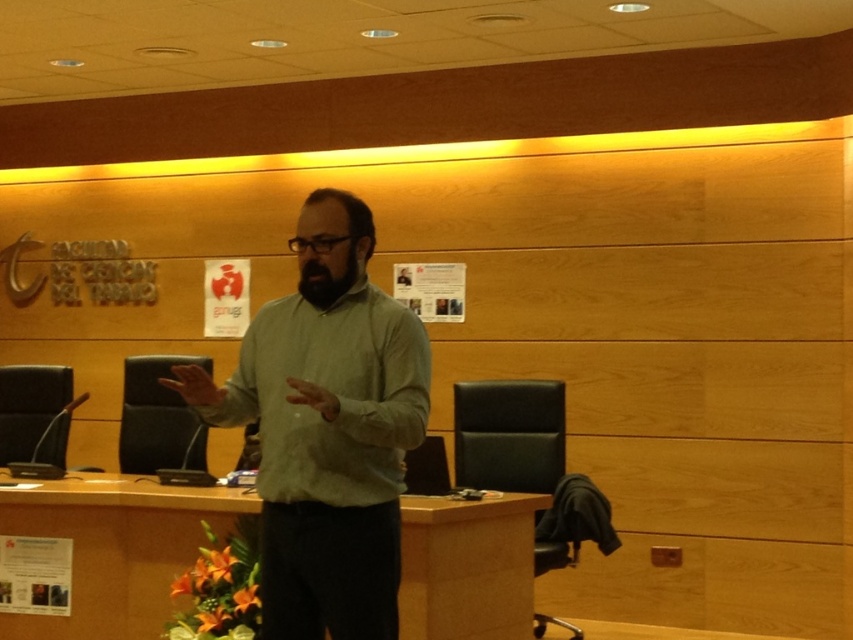
Question: Can you confirm if green matte shirt at center is bigger than black fuzzy beard at center?

Choices:
 (A) yes
 (B) no

Answer: (A)

Question: Estimate the real-world distances between objects in this image. Which object is closer to the black fuzzy beard at center?

Choices:
 (A) green matte dress shirt at center
 (B) green matte shirt at center

Answer: (A)

Question: Estimate the real-world distances between objects in this image. Which object is closer to the black fuzzy beard at center?

Choices:
 (A) green matte shirt at center
 (B) green matte dress shirt at center

Answer: (B)

Question: Which of the following is the closest to the observer?

Choices:
 (A) [325, 307]
 (B) [403, 440]
 (C) [347, 209]

Answer: (B)

Question: Can you confirm if green matte shirt at center is wider than black fuzzy beard at center?

Choices:
 (A) yes
 (B) no

Answer: (A)

Question: Can you confirm if green matte shirt at center is positioned to the right of green matte dress shirt at center?

Choices:
 (A) no
 (B) yes

Answer: (A)